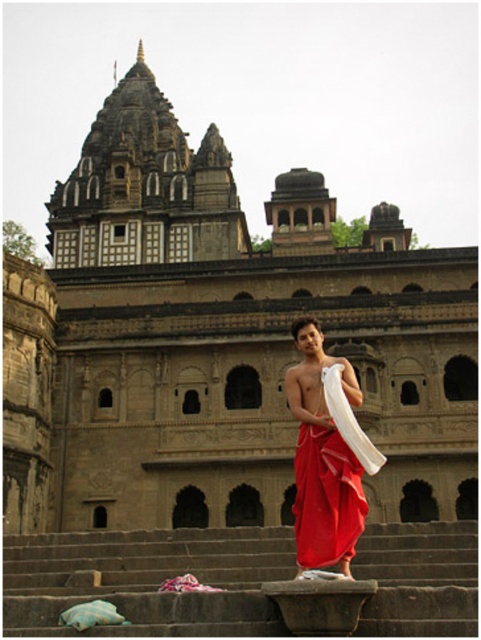
Between smooth stone steps at lower center and dark gray stone hindu temple at upper center, which one is positioned higher?

dark gray stone hindu temple at upper center

Is smooth stone steps at lower center to the left of dark gray stone hindu temple at upper center from the viewer's perspective?

In fact, smooth stone steps at lower center is to the right of dark gray stone hindu temple at upper center.

Between point (138, 602) and point (171, 148), which one is positioned behind?

The point (171, 148) is more distant.

Locate an element on the screen. The width and height of the screenshot is (481, 640). smooth stone steps at lower center is located at coordinates (148, 580).

Is dark gray stone hindu temple at upper center positioned in front of red silk dhoti at center?

No.

Is dark gray stone hindu temple at upper center smaller than red silk dhoti at center?

No, dark gray stone hindu temple at upper center is not smaller than red silk dhoti at center.

In order to click on dark gray stone hindu temple at upper center in this screenshot , I will do `click(144, 188)`.

Between smooth stone steps at lower center and red silk dhoti at center, which one appears on the right side from the viewer's perspective?

Positioned to the right is red silk dhoti at center.

This screenshot has height=640, width=481. Describe the element at coordinates (148, 580) in the screenshot. I see `smooth stone steps at lower center` at that location.

The width and height of the screenshot is (481, 640). Find the location of `smooth stone steps at lower center`. smooth stone steps at lower center is located at coordinates (148, 580).